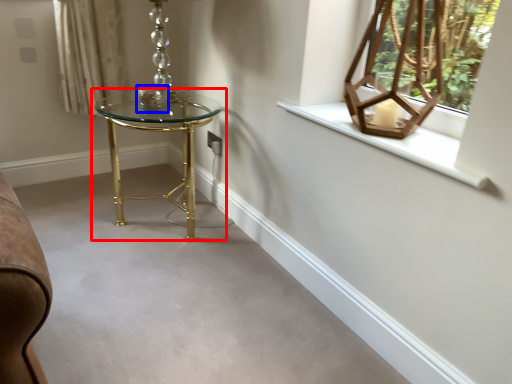
Question: Which object is closer to the camera taking this photo, table (highlighted by a red box) or candle holder (highlighted by a blue box)?

Choices:
 (A) table
 (B) candle holder

Answer: (A)